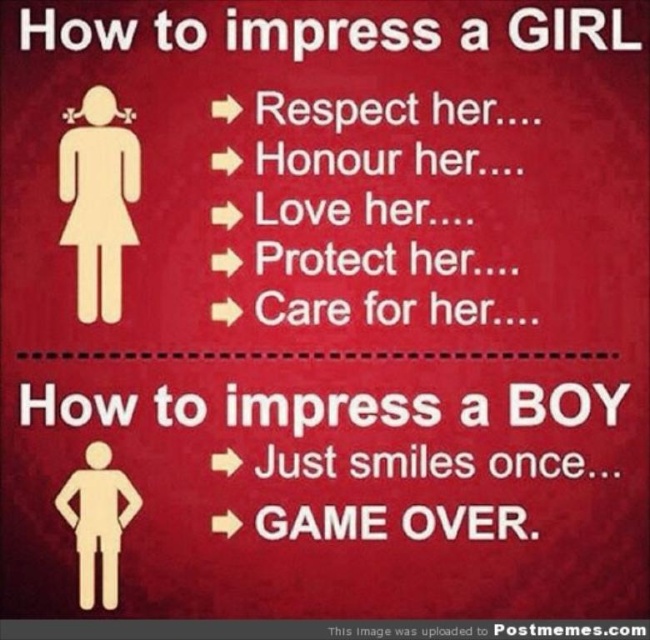
You are a robot with a 15 meter arm. You need to reach the wooden figure at upper left and the white paper man at center. Can your arm reach both objects at the same time?

The wooden figure at upper left and the white paper man at center are 15.14 meters apart. Since your arm is 15 meters long, you cannot reach both objects simultaneously as the distance between them exceeds your arm length.

You are designing a poster for a school event and need to ensure the wooden figure at upper left and the white paper man at center are proportionate. According to the image, which figure is shorter?

The wooden figure at upper left is shorter than the white paper man at center.